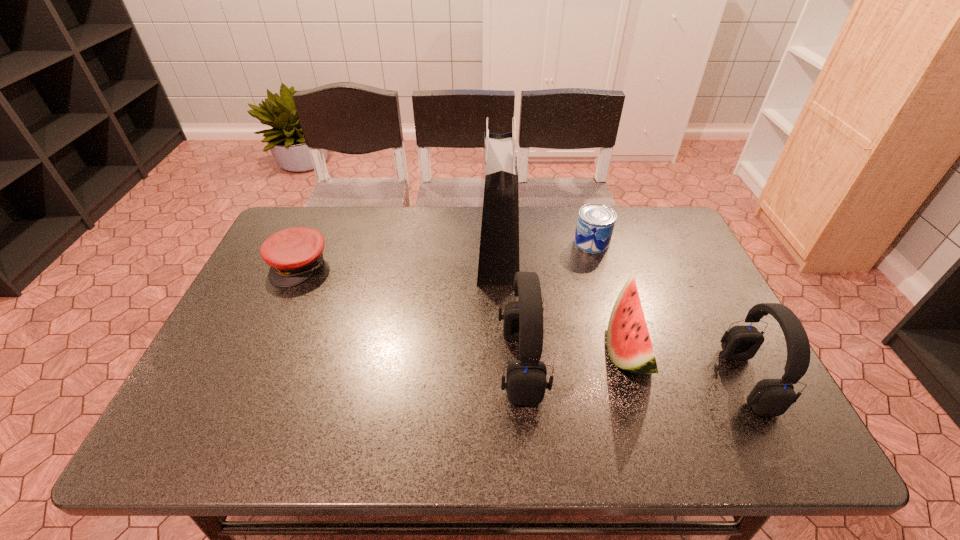
Please point a vacant point for placing a headset on the left. Please provide its 2D coordinates. Your answer should be formatted as a tuple, i.e. [(x, y)], where the tuple contains the x and y coordinates of a point satisfying the conditions above.

[(309, 349)]